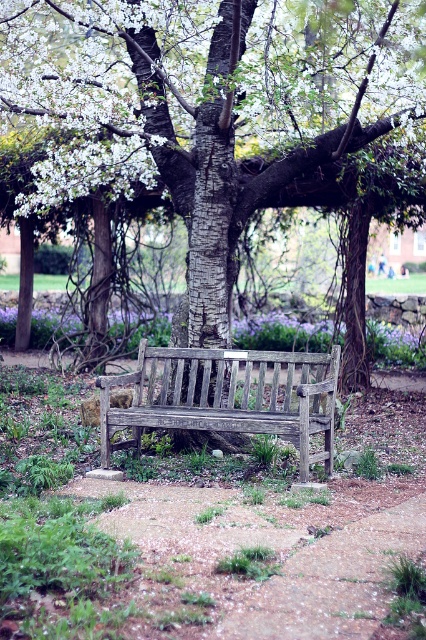
Question: Considering the relative positions of weathered wood bench at center and purple matte flower at center in the image provided, where is weathered wood bench at center located with respect to purple matte flower at center?

Choices:
 (A) below
 (B) above

Answer: (A)

Question: Which point is closer to the camera?

Choices:
 (A) purple matte flower at center
 (B) white blossoms at center

Answer: (B)

Question: Is white blossoms at center below weathered wood bench at center?

Choices:
 (A) no
 (B) yes

Answer: (A)

Question: Which object is closer to the camera taking this photo?

Choices:
 (A) weathered wood bench at center
 (B) smooth bark tree at center
 (C) white blossoms at center

Answer: (A)

Question: Which point appears closest to the camera in this image?

Choices:
 (A) (302, 388)
 (B) (215, 326)
 (C) (132, 22)

Answer: (A)

Question: Observing the image, what is the correct spatial positioning of smooth bark tree at center in reference to purple matte flower at center?

Choices:
 (A) right
 (B) left

Answer: (A)